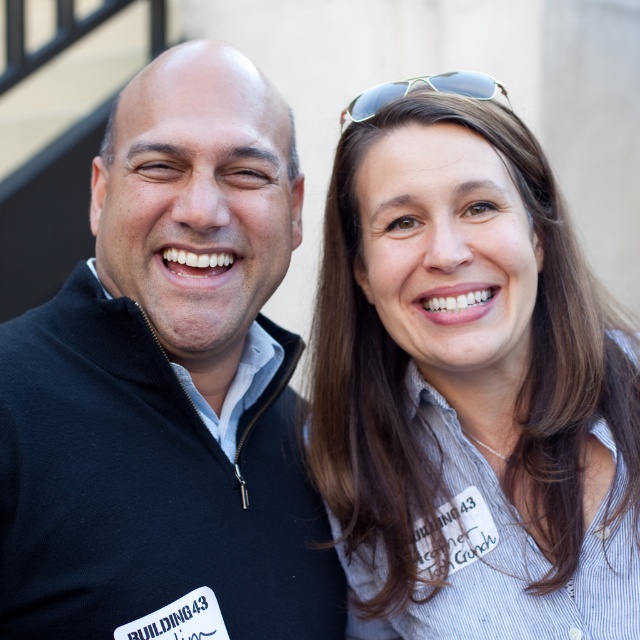
In the scene shown: You are designing a new uniform for the staff at Building 43. The current uniforms include a striped shirt at center and a black fleece at left. Which item of clothing is narrower when worn?

The striped shirt at center is narrower than the black fleece at left because its width is less than the black fleece at left.

You are standing in front of the building where the two people are located. You need to determine which of the two points, point (580, 573) or point (467, 97), is closer to you. Based on the image, which point is nearer?

Point (580, 573) is closer to the viewer than point (467, 97).